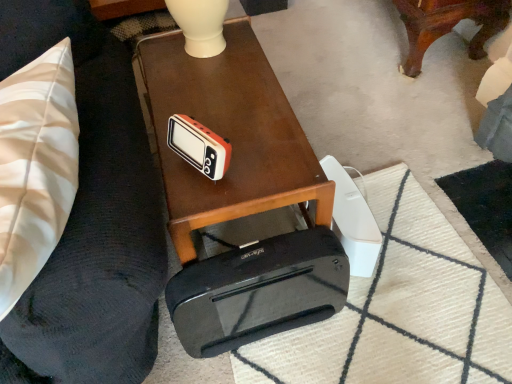
In order to click on blank space situated above black plastic cassette at lower center (from a real-world perspective) in this screenshot , I will do `click(252, 263)`.